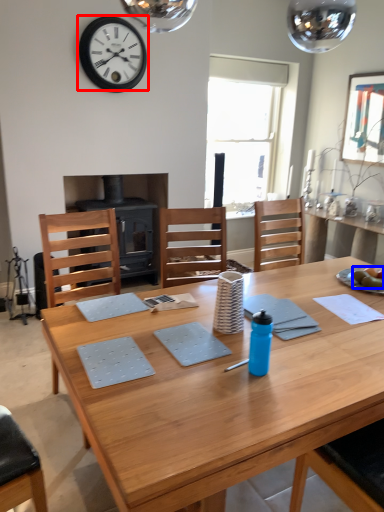
Question: Which object is closer to the camera taking this photo, wall clock (highlighted by a red box) or food (highlighted by a blue box)?

Choices:
 (A) wall clock
 (B) food

Answer: (B)